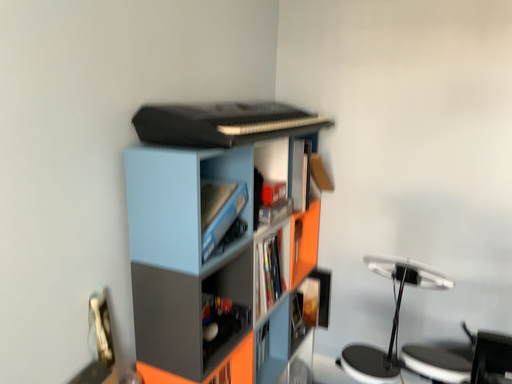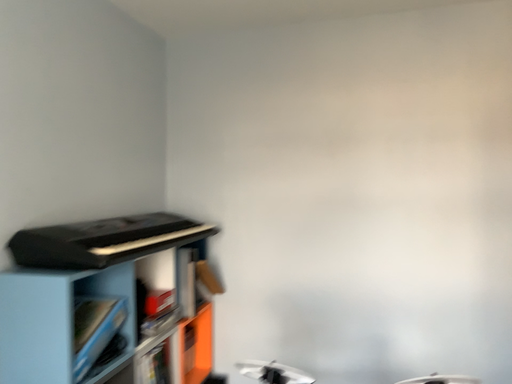
Question: How did the camera likely rotate when shooting the video?

Choices:
 (A) rotated downward
 (B) rotated upward

Answer: (B)